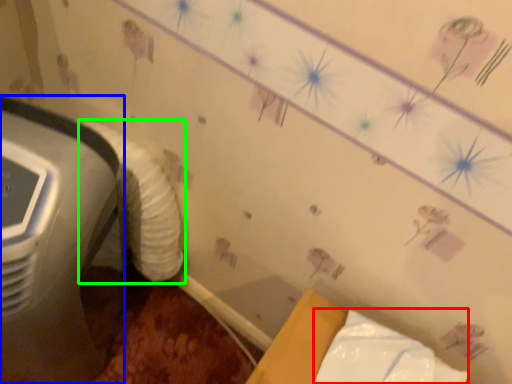
Question: Which object is positioned farthest from wrapping paper (highlighted by a red box)? Select from home appliance (highlighted by a blue box) and sheet (highlighted by a green box).

Choices:
 (A) home appliance
 (B) sheet

Answer: (A)